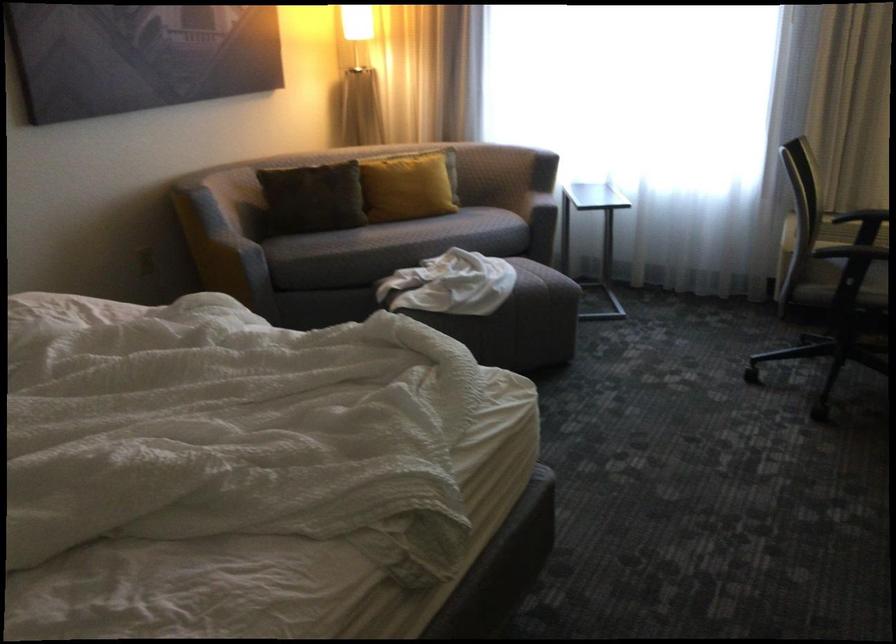
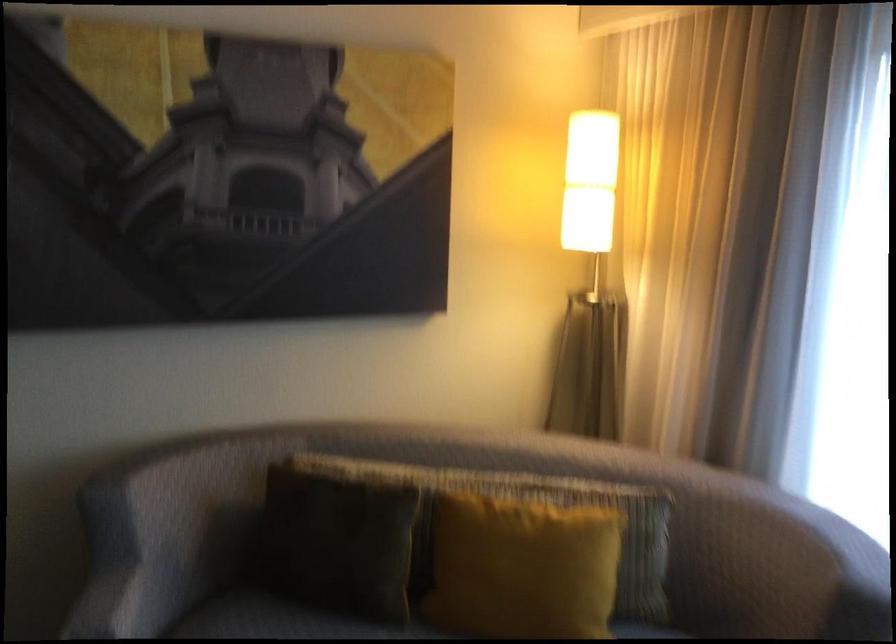
Locate, in the second image, the point that corresponds to (218,231) in the first image.

(119, 569)